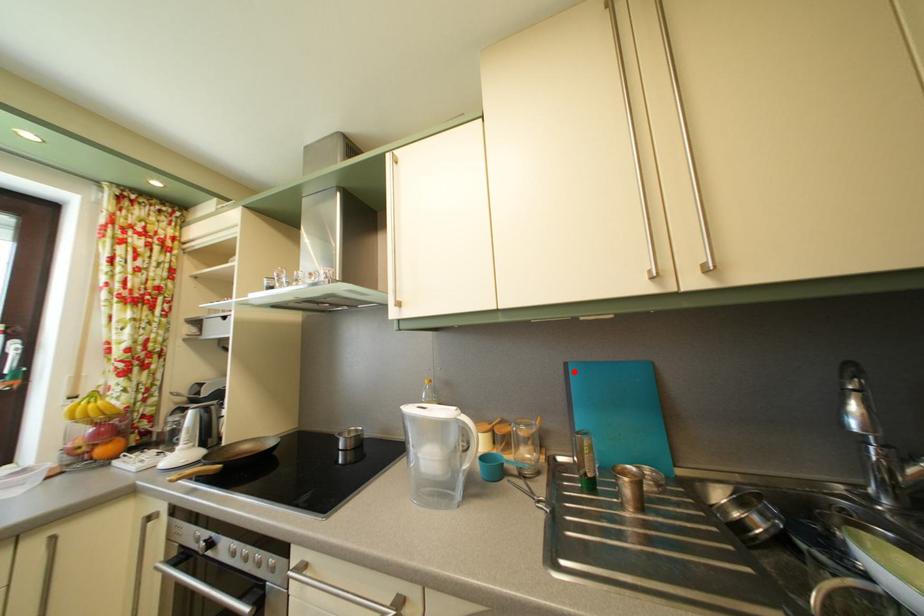
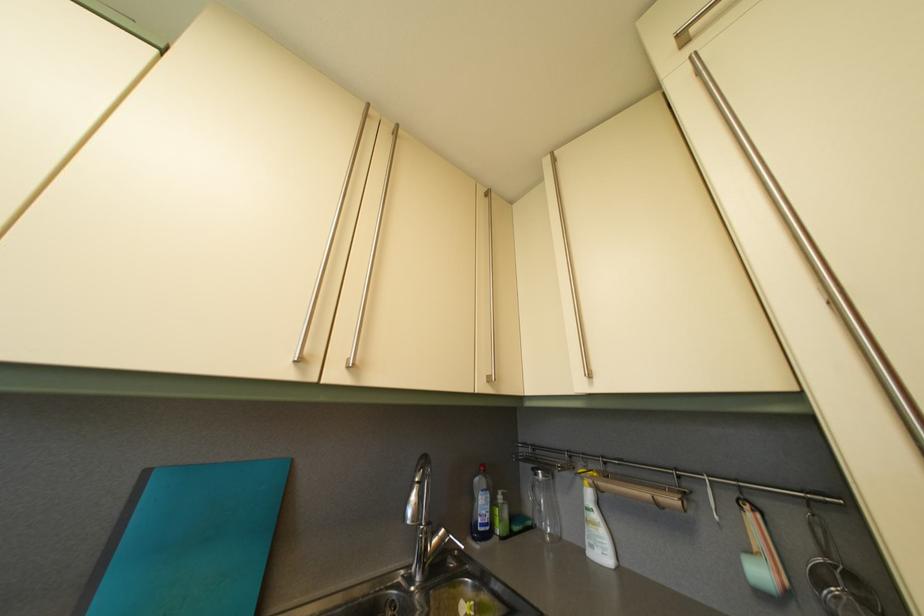
Find the pixel in the second image that matches the highlighted location in the first image.

(154, 480)